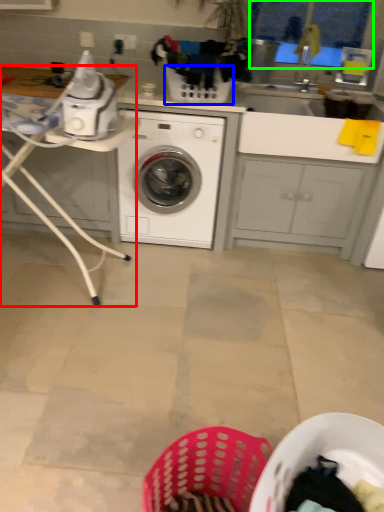
Question: Based on their relative distances, which object is nearer to table (highlighted by a red box)? Choose from basket (highlighted by a blue box) and window screen (highlighted by a green box).

Choices:
 (A) basket
 (B) window screen

Answer: (A)